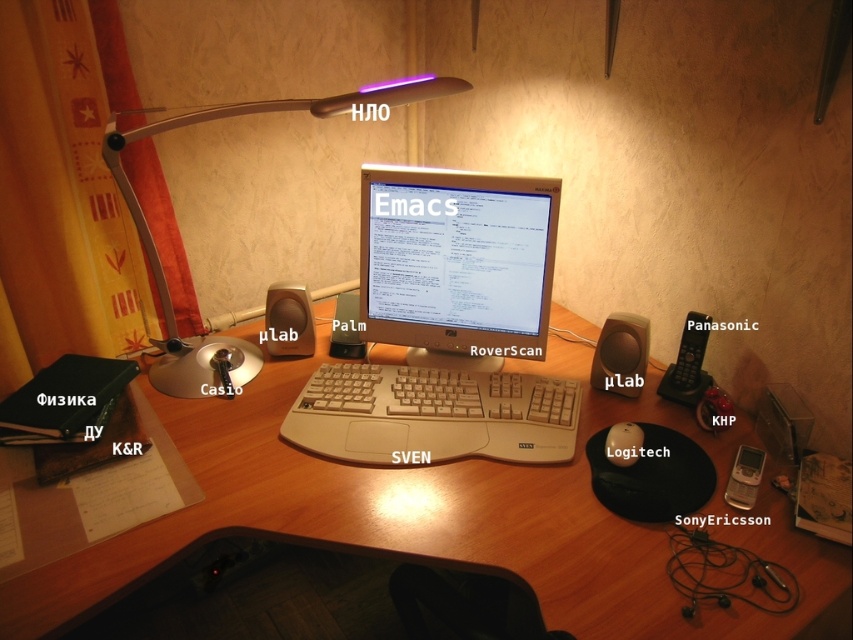
Question: Which of these objects is positioned farthest from the beige plastic monitor at center?

Choices:
 (A) wooden desk at center
 (B) metallic gray lamp at upper left
 (C) matte black mouse at center-right
 (D) matte plastic speaker at center

Answer: (B)

Question: Can you confirm if wooden desk at center is positioned below matte black mouse at center-right?

Choices:
 (A) yes
 (B) no

Answer: (A)

Question: Which point is closer to the camera?

Choices:
 (A) matte black mouse at center-right
 (B) matte brown speaker at center-left
 (C) matte plastic speaker at center
 (D) matte plastic monitor at center

Answer: (A)

Question: Which is nearer to the matte plastic speaker at center?

Choices:
 (A) beige plastic monitor at center
 (B) beige plastic keyboard at center
 (C) matte plastic monitor at center

Answer: (C)

Question: Is the position of wooden desk at center less distant than that of matte plastic monitor at center?

Choices:
 (A) yes
 (B) no

Answer: (A)

Question: Is wooden desk at center positioned before matte black mouse at center-right?

Choices:
 (A) no
 (B) yes

Answer: (B)